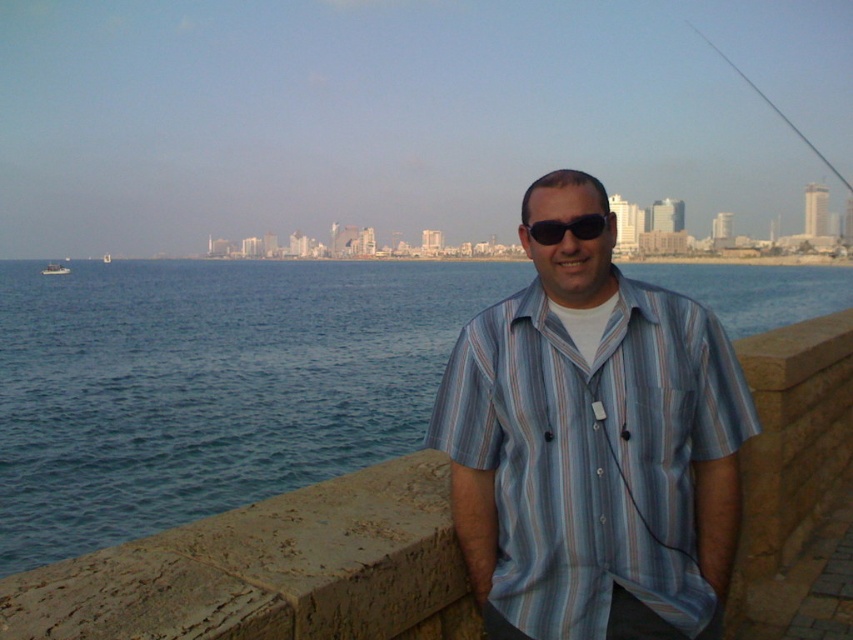
Question: Can you confirm if black plastic sunglasses at center is wider than metallic fishing pole at upper right?

Choices:
 (A) no
 (B) yes

Answer: (A)

Question: Estimate the real-world distances between objects in this image. Which object is closer to the blue striped shirt at center?

Choices:
 (A) black plastic sunglasses at center
 (B) blue water at center

Answer: (A)

Question: Does metallic fishing pole at upper right appear under white plastic boat at left?

Choices:
 (A) yes
 (B) no

Answer: (B)

Question: Among these objects, which one is farthest from the camera?

Choices:
 (A) metallic fishing pole at upper right
 (B) blue striped shirt at center
 (C) white plastic boat at left

Answer: (A)

Question: Which point is closer to the camera?

Choices:
 (A) (564, 232)
 (B) (105, 401)

Answer: (A)

Question: Is blue water at center bigger than white plastic boat at left?

Choices:
 (A) no
 (B) yes

Answer: (B)